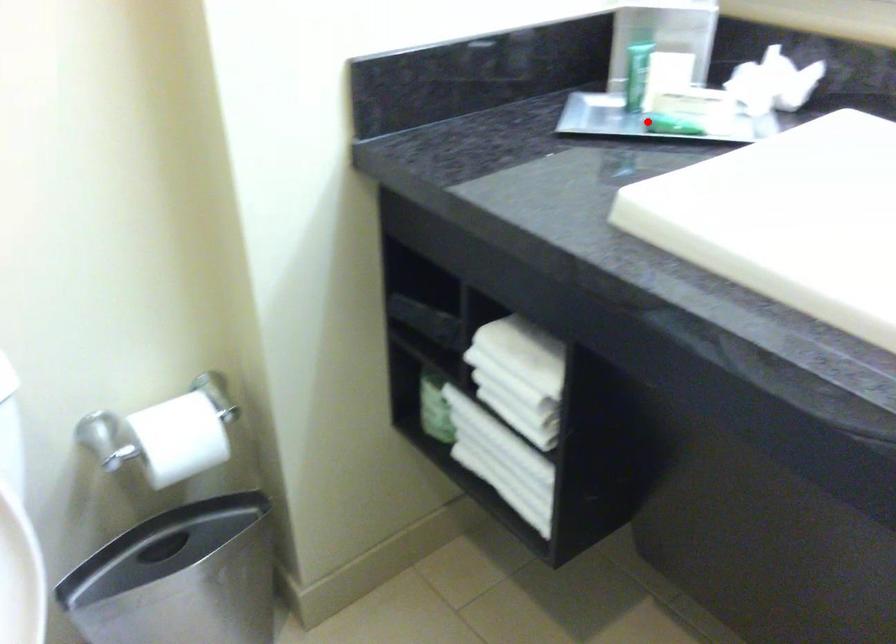
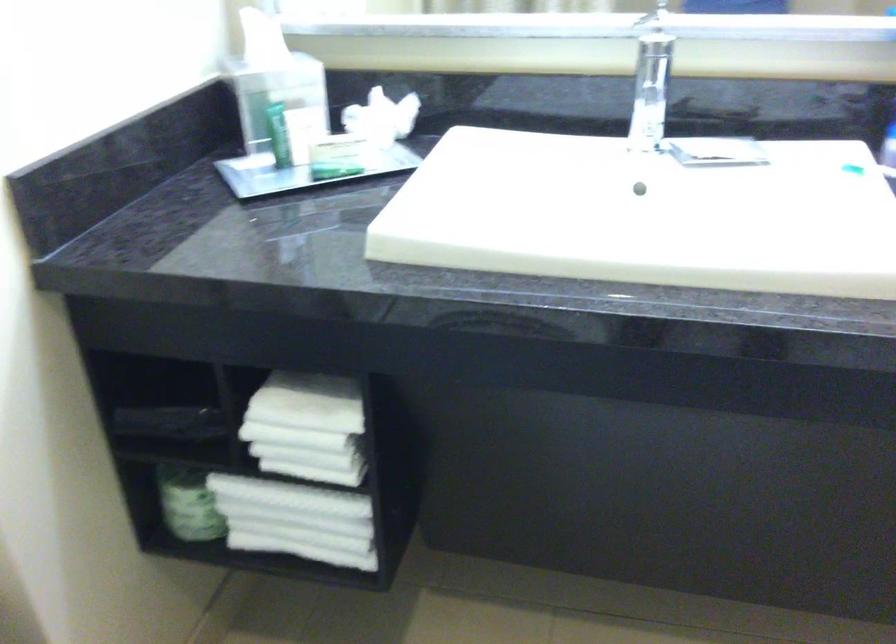
The point at the highlighted location is marked in the first image. Where is the corresponding point in the second image?

(303, 172)